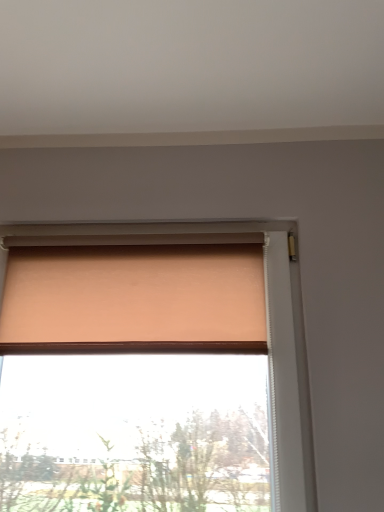
Describe the element at coordinates (134, 298) in the screenshot. I see `matte beige blind at center` at that location.

This screenshot has height=512, width=384. I want to click on matte beige blind at center, so click(134, 298).

Where is `matte beige blind at center`? matte beige blind at center is located at coordinates 134,298.